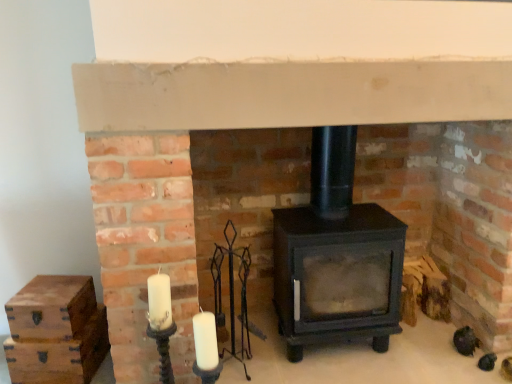
Identify the location of vacant space to the right of matte black wood burning stove at center. (423, 353).